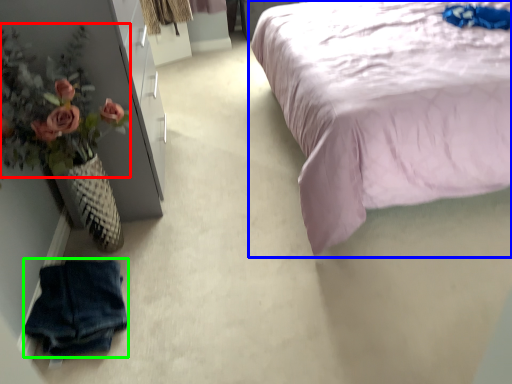
Question: Which object is positioned closest to floral arrangement (highlighted by a red box)? Select from bed (highlighted by a blue box) and clothing (highlighted by a green box).

Choices:
 (A) bed
 (B) clothing

Answer: (B)